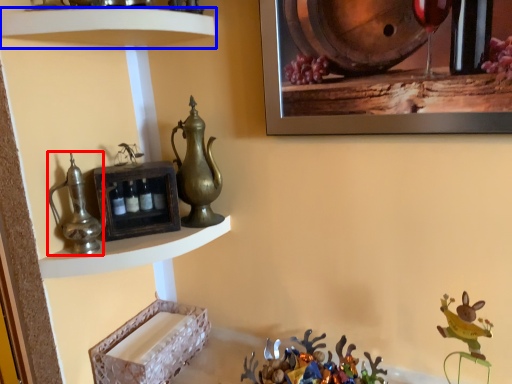
Question: Which object is closer to the camera taking this photo, jug (highlighted by a red box) or shelf (highlighted by a blue box)?

Choices:
 (A) jug
 (B) shelf

Answer: (B)